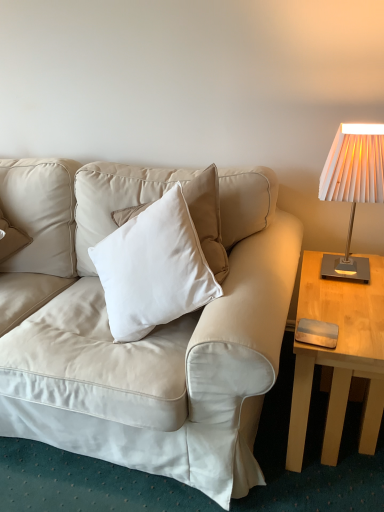
Question: Is metallic silver pad at right inside light wood table at right?

Choices:
 (A) yes
 (B) no

Answer: (A)

Question: Is light wood table at right to the left of metallic silver pad at right from the viewer's perspective?

Choices:
 (A) yes
 (B) no

Answer: (B)

Question: Can you confirm if light wood table at right is taller than metallic silver pad at right?

Choices:
 (A) no
 (B) yes

Answer: (B)

Question: Does light wood table at right have a larger size compared to metallic silver pad at right?

Choices:
 (A) yes
 (B) no

Answer: (A)

Question: Can you confirm if light wood table at right is wider than metallic silver pad at right?

Choices:
 (A) yes
 (B) no

Answer: (A)

Question: Is point (306, 337) positioned closer to the camera than point (331, 190)?

Choices:
 (A) farther
 (B) closer

Answer: (B)

Question: In the image, is metallic silver pad at right on the left side or the right side of white pleated fabric lampshade at right?

Choices:
 (A) right
 (B) left

Answer: (B)

Question: Looking at their shapes, would you say metallic silver pad at right is wider or thinner than white pleated fabric lampshade at right?

Choices:
 (A) thin
 (B) wide

Answer: (A)

Question: Would you say metallic silver pad at right is inside or outside white pleated fabric lampshade at right?

Choices:
 (A) inside
 (B) outside

Answer: (B)

Question: Is beige leather couch at center bigger or smaller than light wood table at right?

Choices:
 (A) big
 (B) small

Answer: (A)

Question: From a real-world perspective, relative to light wood table at right, is beige leather couch at center vertically above or below?

Choices:
 (A) above
 (B) below

Answer: (A)

Question: Looking at their shapes, would you say beige leather couch at center is wider or thinner than light wood table at right?

Choices:
 (A) wide
 (B) thin

Answer: (B)

Question: Is beige leather couch at center situated inside light wood table at right or outside?

Choices:
 (A) outside
 (B) inside

Answer: (A)

Question: In terms of width, does white pleated fabric lampshade at right look wider or thinner when compared to metallic silver pad at right?

Choices:
 (A) thin
 (B) wide

Answer: (B)

Question: Considering their positions, is white pleated fabric lampshade at right located in front of or behind metallic silver pad at right?

Choices:
 (A) behind
 (B) front

Answer: (B)